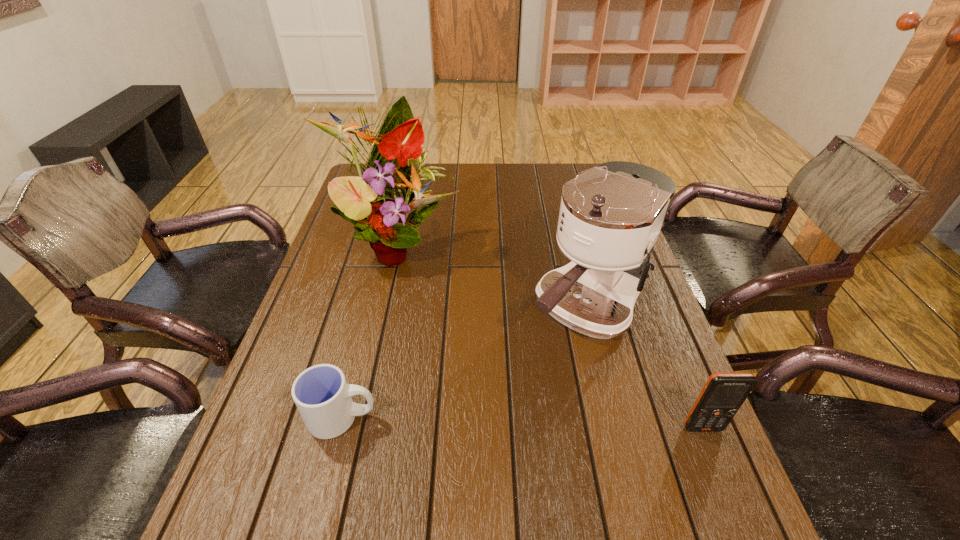
Where is `the shortest object`? the shortest object is located at coordinates (324, 399).

Locate an element on the screen. This screenshot has width=960, height=540. cellular telephone is located at coordinates (723, 394).

Find the location of a particular element. Image resolution: width=960 pixels, height=540 pixels. coffee maker is located at coordinates (610, 217).

At what (x,y) coordinates should I click in order to perform the action: click on bouquet. Please return your answer as a coordinate pair (x, y). Looking at the image, I should click on (380, 203).

The height and width of the screenshot is (540, 960). Find the location of `free space located 0.370m with the handle on the side of the cup`. free space located 0.370m with the handle on the side of the cup is located at coordinates (557, 418).

Find the location of a particular element. Image resolution: width=960 pixels, height=540 pixels. vacant space located on the screen of the third tallest object is located at coordinates (717, 462).

Identify the location of free region located 0.150m on the front-facing side of the coffee maker. The height and width of the screenshot is (540, 960). [x=514, y=390].

Find the location of a particular element. Image resolution: width=960 pixels, height=540 pixels. vacant area situated on the front-facing side of the coffee maker is located at coordinates (505, 399).

Locate an element on the screen. The height and width of the screenshot is (540, 960). vacant space located 0.210m on the front-facing side of the coffee maker is located at coordinates (496, 408).

This screenshot has width=960, height=540. In order to click on vacant area located on the front-facing side of the bouquet in this screenshot , I will do `click(474, 325)`.